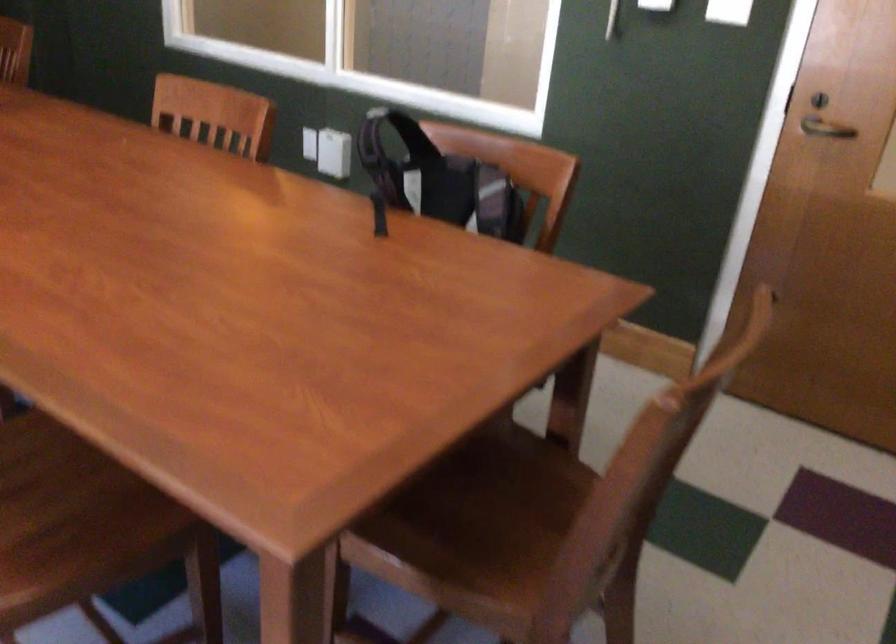
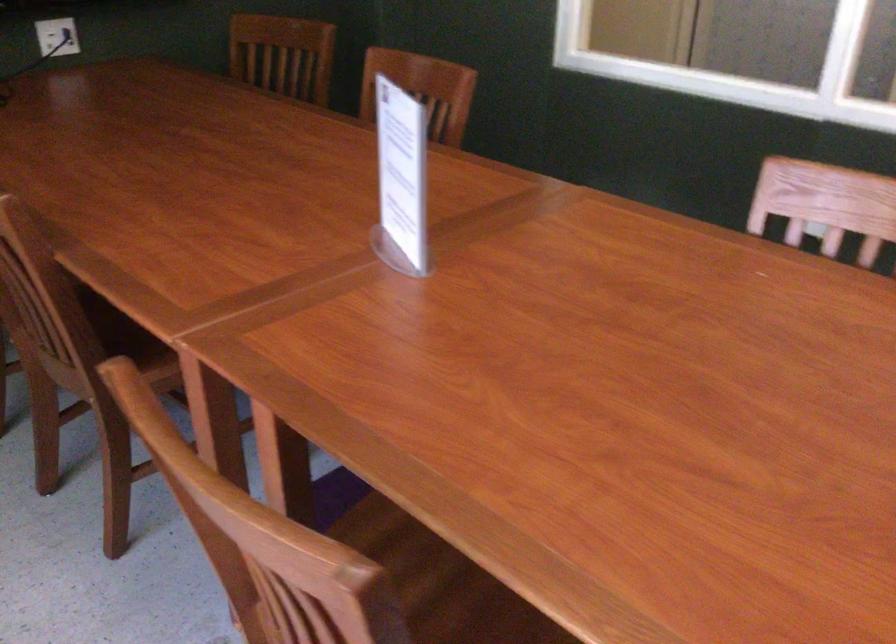
In a continuous first-person perspective shot, in which direction is the camera moving?

The movement direction of the cameraman is left, forward.